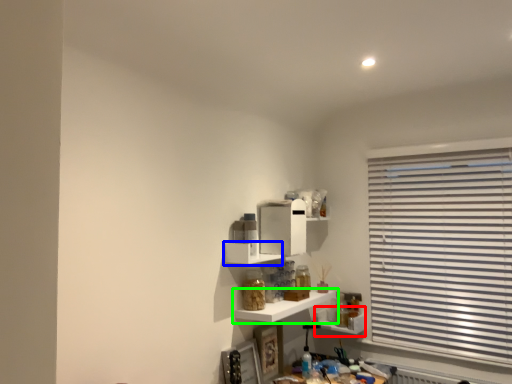
Question: Which object is positioned farthest from shelf (highlighted by a red box)? Select from shelf (highlighted by a blue box) and shelf (highlighted by a green box).

Choices:
 (A) shelf
 (B) shelf

Answer: (A)